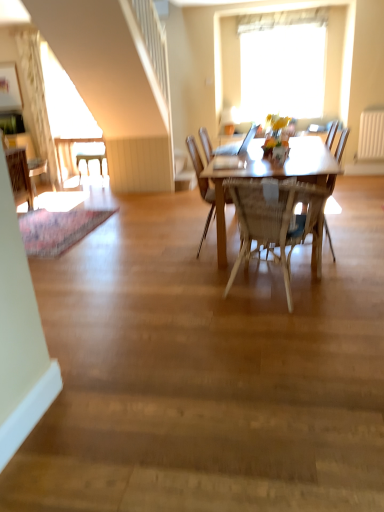
Locate an element on the screen. This screenshot has width=384, height=512. vacant point to the left of light brown wooden table at center is located at coordinates (139, 259).